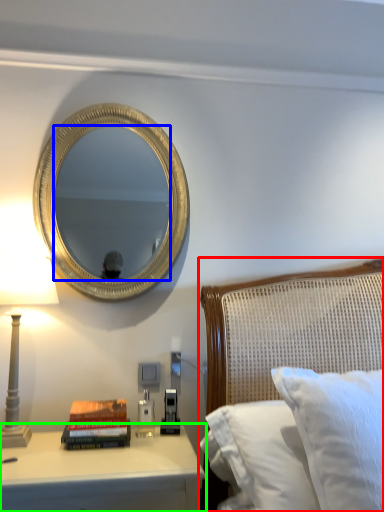
Question: Considering the real-world distances, which object is closest to bed (highlighted by a red box)? mirror (highlighted by a blue box) or nightstand (highlighted by a green box).

Choices:
 (A) mirror
 (B) nightstand

Answer: (B)